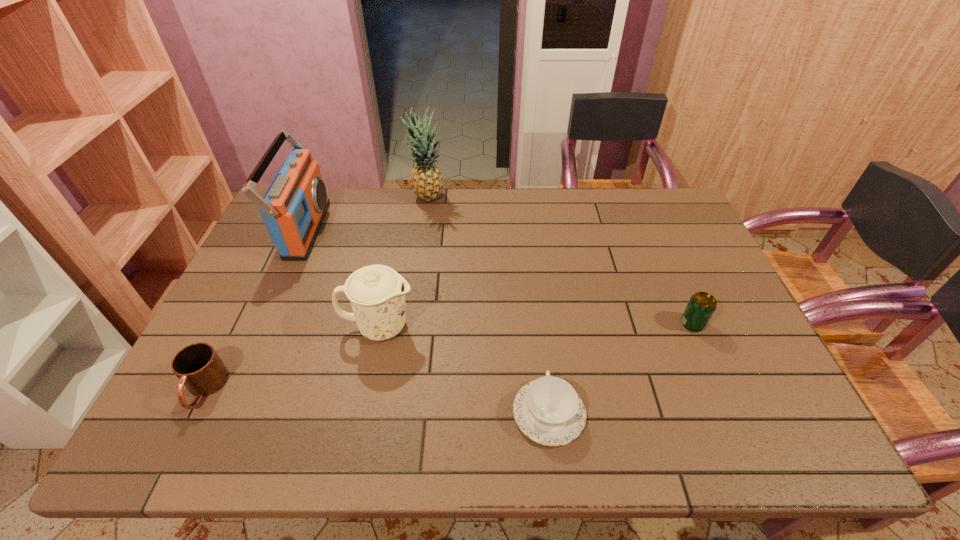
Image resolution: width=960 pixels, height=540 pixels. Find the location of `empty space that is in between the farther chinaware and the mug`. empty space that is in between the farther chinaware and the mug is located at coordinates (292, 358).

This screenshot has height=540, width=960. In order to click on empty space between the pineapple and the nearer chinaware in this screenshot , I will do `click(489, 306)`.

At what (x,y) coordinates should I click in order to perform the action: click on free spot between the shortest object and the beer can. Please return your answer as a coordinate pair (x, y). Looking at the image, I should click on (621, 369).

Where is `free space between the pineapple and the radio receiver`? free space between the pineapple and the radio receiver is located at coordinates (367, 214).

This screenshot has height=540, width=960. Identify the location of free space between the third tallest object and the mug. (292, 358).

Where is `free space between the beer can and the shortest object`? free space between the beer can and the shortest object is located at coordinates (621, 369).

I want to click on free area in between the pineapple and the beer can, so click(560, 261).

I want to click on free space between the left chinaware and the nearer chinaware, so click(x=464, y=370).

Identify the location of vacant area that lies between the mug and the beer can. (448, 356).

At what (x,y) coordinates should I click in order to perform the action: click on object that is the third closest to the mug. Please return your answer as a coordinate pair (x, y). Looking at the image, I should click on (548, 410).